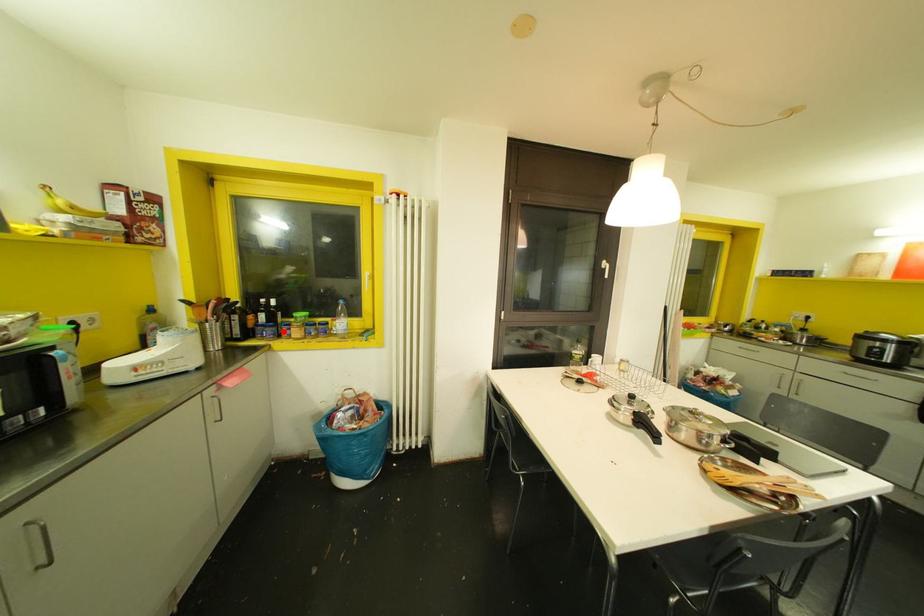
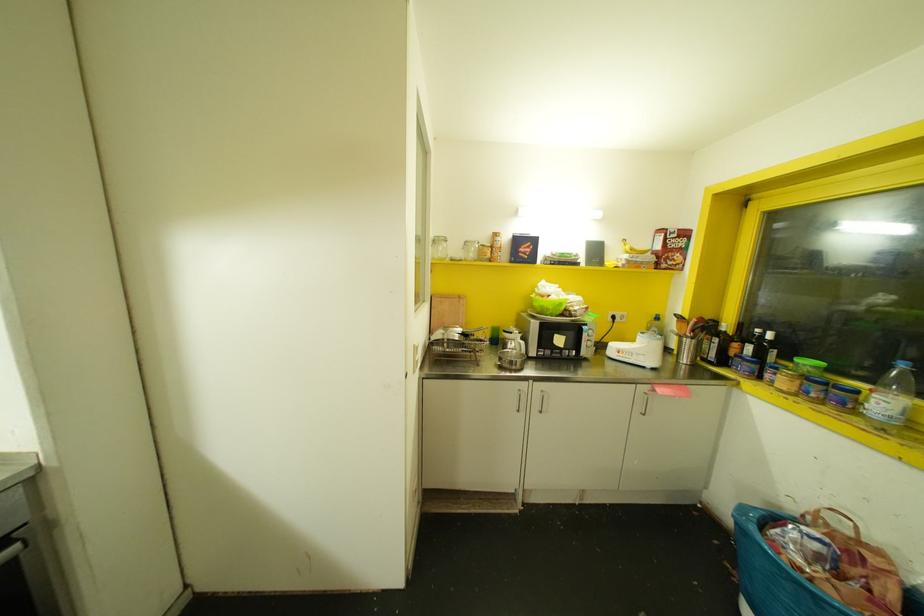
In the second image, find the point that corresponds to the highlighted location in the first image.

(767, 375)